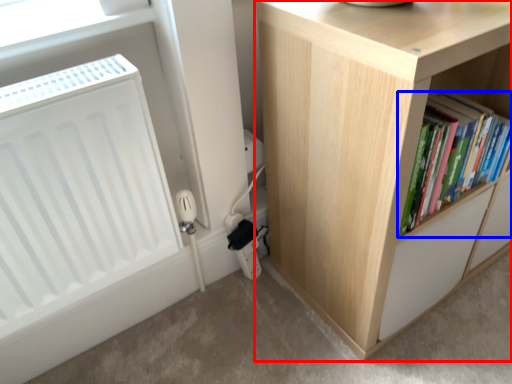
Question: Among these objects, which one is nearest to the camera, cupboard (highlighted by a red box) or book (highlighted by a blue box)?

Choices:
 (A) cupboard
 (B) book

Answer: (A)